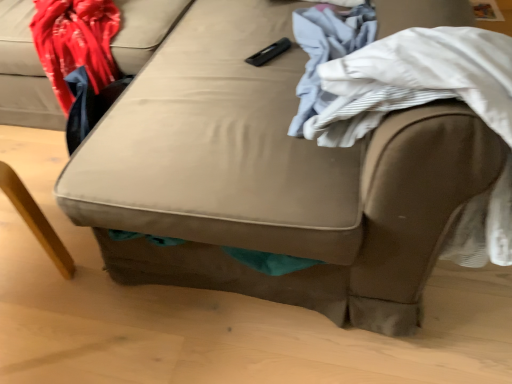
The height and width of the screenshot is (384, 512). I want to click on white cotton shirt at upper right, so click(326, 50).

Describe the element at coordinates (326, 50) in the screenshot. This screenshot has width=512, height=384. I see `white cotton shirt at upper right` at that location.

What is the approximate width of white cotton shirt at upper right?

It is 10.02 inches.

Find the location of `white cotton shirt at upper right`. white cotton shirt at upper right is located at coordinates (326, 50).